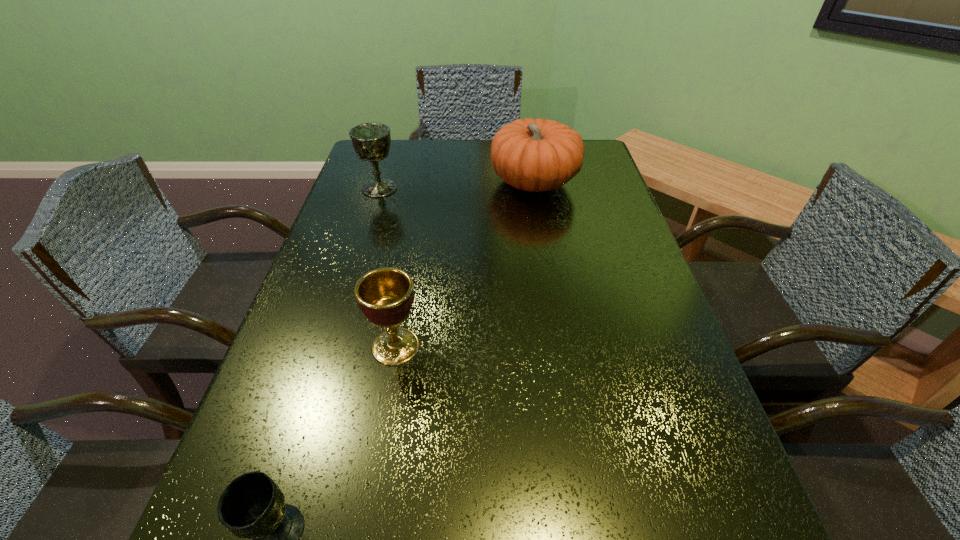
Image resolution: width=960 pixels, height=540 pixels. What are the coordinates of `object that is at the far right corner` in the screenshot? It's located at (535, 155).

Locate an element on the screen. Image resolution: width=960 pixels, height=540 pixels. vacant space at the far edge is located at coordinates (443, 159).

The image size is (960, 540). What are the coordinates of `free space at the left edge of the desktop` in the screenshot? It's located at click(240, 474).

Locate an element on the screen. This screenshot has height=540, width=960. vacant space at the right edge of the desktop is located at coordinates (666, 346).

Where is `blank space at the far left corner of the desktop`? This screenshot has width=960, height=540. blank space at the far left corner of the desktop is located at coordinates (402, 163).

The width and height of the screenshot is (960, 540). I want to click on vacant point located between the pumpkin and the farthest chalice, so click(x=457, y=185).

Where is `free space that is in between the rightmost object and the farthest chalice`? The width and height of the screenshot is (960, 540). free space that is in between the rightmost object and the farthest chalice is located at coordinates (457, 185).

Identify the location of free point between the farthest chalice and the pumpkin. (457, 185).

Locate an element on the screen. The width and height of the screenshot is (960, 540). free space that is in between the rightmost object and the farthest chalice is located at coordinates (457, 185).

In order to click on object that is the second closest one to the rightmost chalice in this screenshot , I will do pyautogui.click(x=535, y=155).